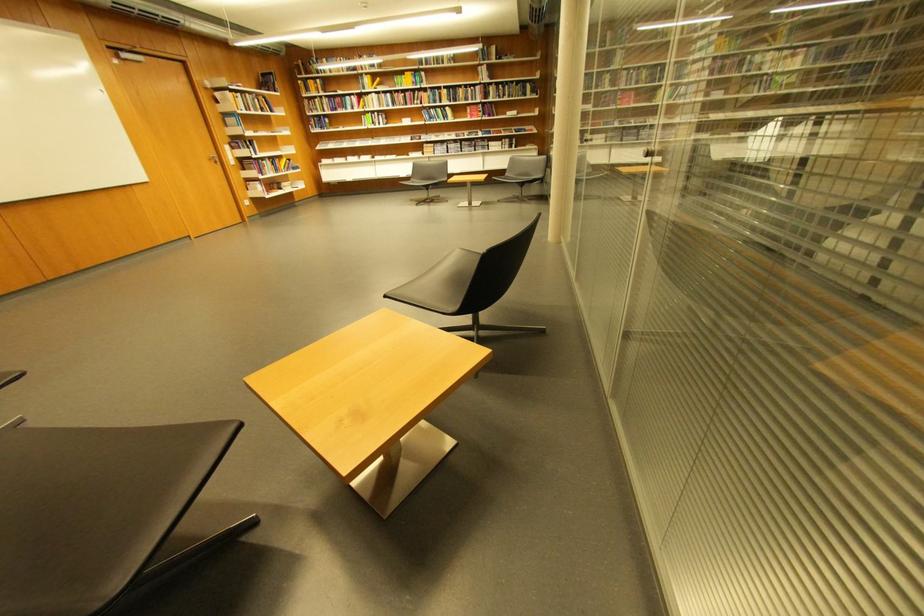
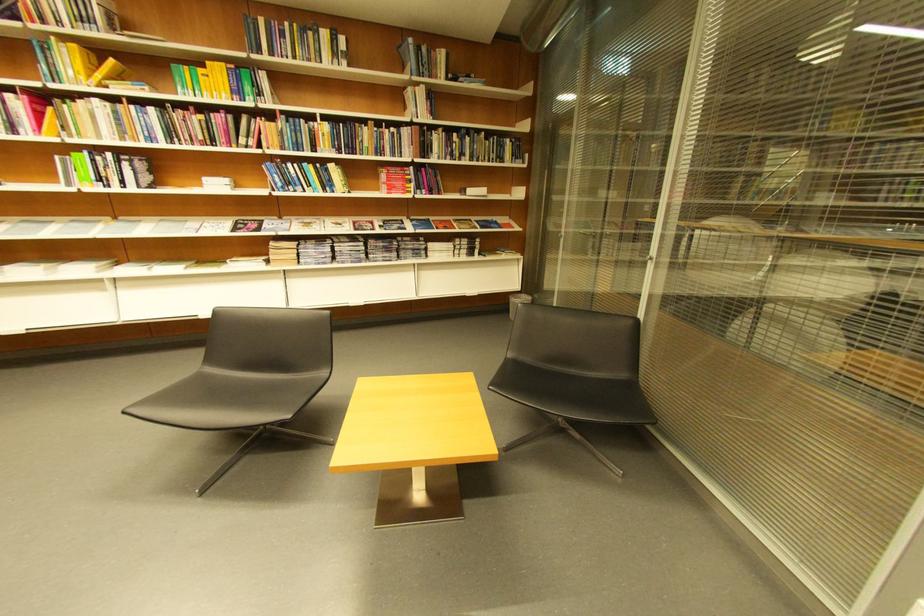
In the second image, find the point that corresponds to pixel 499 62 in the first image.

(441, 78)